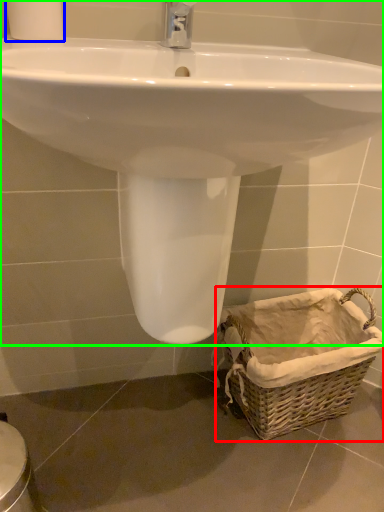
Question: Which object is the closest to the basket (highlighted by a red box)? Choose among these: toilet paper (highlighted by a blue box) or sink (highlighted by a green box).

Choices:
 (A) toilet paper
 (B) sink

Answer: (B)